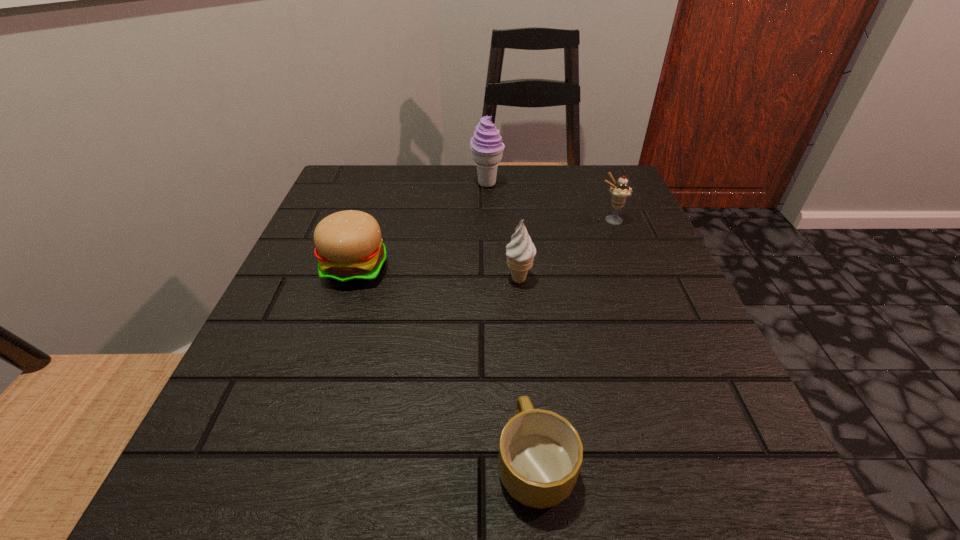
Find the location of a particular element. The width and height of the screenshot is (960, 540). vacant region that satisfies the following two spatial constraints: 1. on the back side of the tallest icecream; 2. on the right side of the leftmost object is located at coordinates (384, 184).

Identify the location of vacant region that satisfies the following two spatial constraints: 1. on the back side of the tallest object; 2. on the right side of the leftmost object. This screenshot has width=960, height=540. (384, 184).

The width and height of the screenshot is (960, 540). I want to click on free space that satisfies the following two spatial constraints: 1. on the side with the handle of the rightmost icecream; 2. on the left side of the mug, so click(512, 220).

This screenshot has width=960, height=540. I want to click on free spot that satisfies the following two spatial constraints: 1. on the back side of the hamburger; 2. on the left side of the farthest object, so click(384, 184).